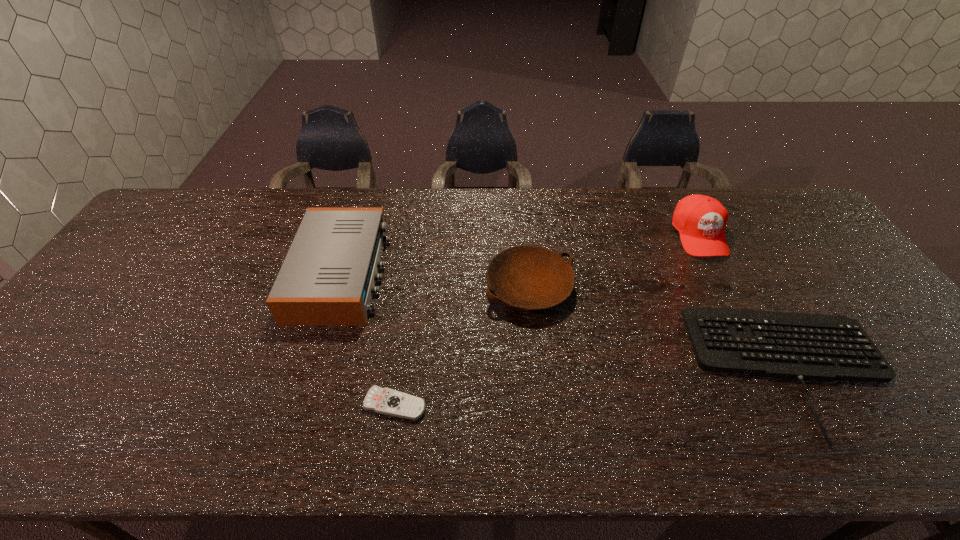
The image size is (960, 540). Identify the location of baseball cap. (701, 220).

The image size is (960, 540). Identify the location of the fourth shortest object. (328, 277).

Where is `radio receiver`? This screenshot has height=540, width=960. radio receiver is located at coordinates (328, 277).

Identify the location of the third tallest object. Image resolution: width=960 pixels, height=540 pixels. (529, 277).

Identify the location of plate. pyautogui.click(x=529, y=277).

Locate an element on the screen. computer keyboard is located at coordinates (818, 347).

You are a GUI agent. You are given a task and a screenshot of the screen. Output one action in this format:
    pyautogui.click(x=<x>, y=<y>)
    Task: Click on the shortest object
    
    Given the screenshot: What is the action you would take?
    pyautogui.click(x=387, y=401)

You are a GUI agent. You are given a task and a screenshot of the screen. Output one action in this format:
    pyautogui.click(x=<x>, y=<y>)
    Task: Click on the fourth object from right to left
    The image size is (960, 540).
    Given the screenshot: What is the action you would take?
    pyautogui.click(x=387, y=401)

Locate an element on the screen. The width and height of the screenshot is (960, 540). free space located on the front panel of the baseball cap is located at coordinates (749, 331).

Find the location of a particular element. This screenshot has height=540, width=960. free space located 0.260m on the front panel of the leftmost object is located at coordinates (474, 273).